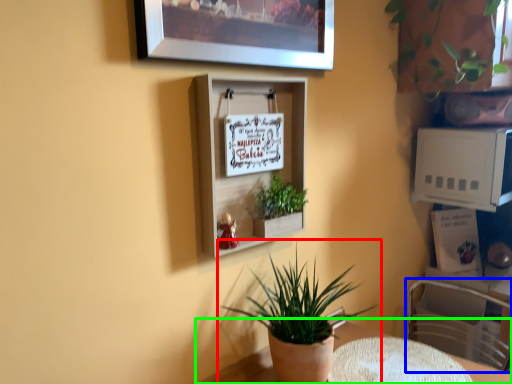
Question: Estimate the real-world distances between objects in this image. Which object is closer to houseplant (highlighted by a red box), swivel chair (highlighted by a blue box) or table (highlighted by a green box)?

Choices:
 (A) swivel chair
 (B) table

Answer: (B)